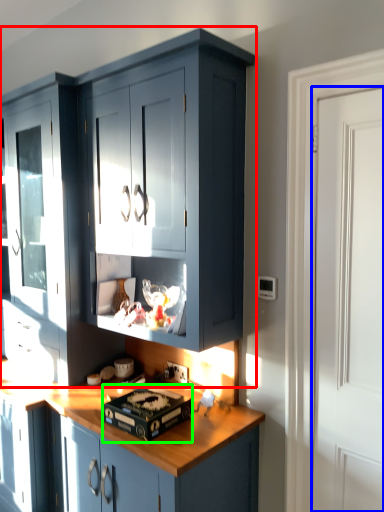
Question: Which is farther away from cabinetry (highlighted by a red box)? door (highlighted by a blue box) or appliance (highlighted by a green box)?

Choices:
 (A) door
 (B) appliance

Answer: (A)